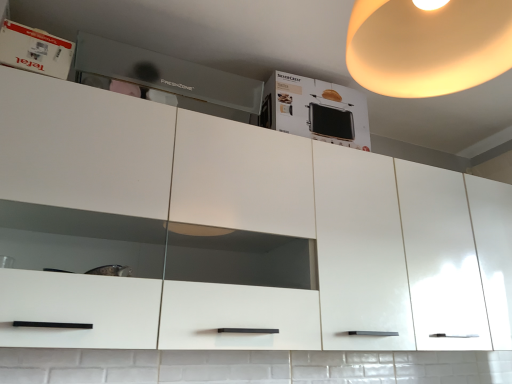
What do you see at coordinates (167, 73) in the screenshot? I see `matte gray drawer at upper center` at bounding box center [167, 73].

What are the coordinates of `matte gray drawer at upper center` in the screenshot? It's located at (167, 73).

Locate an element on the screen. The width and height of the screenshot is (512, 384). warm matte lampshade at upper right is located at coordinates (428, 46).

This screenshot has height=384, width=512. What are the coordinates of `matte gray drawer at upper center` in the screenshot? It's located at (167, 73).

From the image's perspective, is matte gray drawer at upper center located above white cardboard box at upper center?

Yes, from the image's perspective, matte gray drawer at upper center is over white cardboard box at upper center.

Considering the sizes of objects matte gray drawer at upper center and white cardboard box at upper center in the image provided, who is taller, matte gray drawer at upper center or white cardboard box at upper center?

With more height is white cardboard box at upper center.

Considering the relative sizes of matte gray drawer at upper center and white cardboard box at upper center in the image provided, is matte gray drawer at upper center bigger than white cardboard box at upper center?

Incorrect, matte gray drawer at upper center is not larger than white cardboard box at upper center.

Is there a large distance between matte gray drawer at upper center and white cardboard box at upper center?

Actually, matte gray drawer at upper center and white cardboard box at upper center are a little close together.

From a real-world perspective, which object stands above the other?

From a 3D spatial view, white cardboard box at upper center is above.

Measure the distance between white cardboard box at upper center and matte gray drawer at upper center.

A distance of 9.57 inches exists between white cardboard box at upper center and matte gray drawer at upper center.

Visually, is white cardboard box at upper center positioned to the left or to the right of matte gray drawer at upper center?

Based on their positions, white cardboard box at upper center is located to the right of matte gray drawer at upper center.

Consider the image. Considering the sizes of white cardboard box at upper center and matte gray drawer at upper center in the image, is white cardboard box at upper center taller or shorter than matte gray drawer at upper center?

In the image, white cardboard box at upper center appears to be taller than matte gray drawer at upper center.

Looking at their sizes, would you say warm matte lampshade at upper right is wider or thinner than matte gray drawer at upper center?

Considering their sizes, warm matte lampshade at upper right looks broader than matte gray drawer at upper center.

From the picture: Is warm matte lampshade at upper right looking in the opposite direction of matte gray drawer at upper center?

No, warm matte lampshade at upper right's orientation is not away from matte gray drawer at upper center.

Is warm matte lampshade at upper right outside of matte gray drawer at upper center?

Absolutely, warm matte lampshade at upper right is external to matte gray drawer at upper center.

Considering the positions of objects warm matte lampshade at upper right and matte gray drawer at upper center in the image provided, who is more to the right, warm matte lampshade at upper right or matte gray drawer at upper center?

Positioned to the right is warm matte lampshade at upper right.

Consider the image. From a real-world perspective, is white cardboard box at upper center located higher than white glossy box at upper left?

Yes, from a real-world perspective, white cardboard box at upper center is above white glossy box at upper left.

Looking at this image, can you tell me how much white cardboard box at upper center and white glossy box at upper left differ in facing direction?

They differ by 7.98e-05 degrees in their facing directions.

Is white cardboard box at upper center next to white glossy box at upper left and touching it?

They are not placed beside each other.

Image resolution: width=512 pixels, height=384 pixels. Find the location of `cabinetry below the white glossy box at upper left (from the image's perspective)`. cabinetry below the white glossy box at upper left (from the image's perspective) is located at coordinates (315, 110).

Are matte gray drawer at upper center and white glossy box at upper left far apart?

Actually, matte gray drawer at upper center and white glossy box at upper left are a little close together.

Considering the relative positions of matte gray drawer at upper center and white glossy box at upper left in the image provided, is matte gray drawer at upper center to the left of white glossy box at upper left from the viewer's perspective?

In fact, matte gray drawer at upper center is to the right of white glossy box at upper left.

How many degrees apart are the facing directions of matte gray drawer at upper center and white glossy box at upper left?

There is a 7.74e-05-degree angle between the facing directions of matte gray drawer at upper center and white glossy box at upper left.

Is matte gray drawer at upper center facing away from white glossy box at upper left?

That's not correct — matte gray drawer at upper center is not looking away from white glossy box at upper left.

From the image's perspective, is warm matte lampshade at upper right on white cardboard box at upper center?

Yes, from the image's perspective, warm matte lampshade at upper right is on top of white cardboard box at upper center.

Is warm matte lampshade at upper right inside or outside of white cardboard box at upper center?

The correct answer is: outside.

Based on the photo, from a real-world perspective, is warm matte lampshade at upper right positioned over white cardboard box at upper center based on gravity?

Yes, from a real-world perspective, warm matte lampshade at upper right is on top of white cardboard box at upper center.

Is warm matte lampshade at upper right aimed at white cardboard box at upper center?

No, warm matte lampshade at upper right is not turned towards white cardboard box at upper center.

Can you confirm if white glossy box at upper left is positioned to the right of matte gray drawer at upper center?

No, white glossy box at upper left is not to the right of matte gray drawer at upper center.

Is matte gray drawer at upper center surrounded by white glossy box at upper left?

No, matte gray drawer at upper center is located outside of white glossy box at upper left.

From a real-world perspective, is white glossy box at upper left positioned above or below matte gray drawer at upper center?

Clearly, from a real-world perspective, white glossy box at upper left is below matte gray drawer at upper center.

Locate an element on the screen. The height and width of the screenshot is (384, 512). cabinetry above the matte gray drawer at upper center (from a real-world perspective) is located at coordinates (315, 110).

The height and width of the screenshot is (384, 512). I want to click on cabinetry below the matte gray drawer at upper center (from the image's perspective), so click(x=315, y=110).

From the picture: Based on their spatial positions, is white glossy box at upper left or warm matte lampshade at upper right closer to matte gray drawer at upper center?

Among the two, white glossy box at upper left is located nearer to matte gray drawer at upper center.

Estimate the real-world distances between objects in this image. Which object is closer to white glossy box at upper left, white cardboard box at upper center or matte gray drawer at upper center?

matte gray drawer at upper center is closer to white glossy box at upper left.

Estimate the real-world distances between objects in this image. Which object is further from white glossy box at upper left, matte gray drawer at upper center or warm matte lampshade at upper right?

The object further to white glossy box at upper left is warm matte lampshade at upper right.

Estimate the real-world distances between objects in this image. Which object is closer to white cardboard box at upper center, warm matte lampshade at upper right or matte gray drawer at upper center?

matte gray drawer at upper center is closer to white cardboard box at upper center.

Looking at the image, which one is located further to white cardboard box at upper center, white glossy box at upper left or warm matte lampshade at upper right?

white glossy box at upper left.

Looking at the image, which one is located further to warm matte lampshade at upper right, white glossy box at upper left or white cardboard box at upper center?

Based on the image, white glossy box at upper left appears to be further to warm matte lampshade at upper right.

Estimate the real-world distances between objects in this image. Which object is further from warm matte lampshade at upper right, white cardboard box at upper center or white glossy box at upper left?

white glossy box at upper left.

Based on their spatial positions, is white glossy box at upper left or matte gray drawer at upper center closer to warm matte lampshade at upper right?

Among the two, matte gray drawer at upper center is located nearer to warm matte lampshade at upper right.

Find the location of a particular element. This screenshot has height=384, width=512. home appliance situated between white glossy box at upper left and white cardboard box at upper center from left to right is located at coordinates (167, 73).

This screenshot has width=512, height=384. Identify the location of cabinetry located between white glossy box at upper left and warm matte lampshade at upper right in the left-right direction. (315, 110).

You are a GUI agent. You are given a task and a screenshot of the screen. Output one action in this format:
    pyautogui.click(x=<x>, y=<y>)
    Task: Click on the cabinetry between matte gray drawer at upper center and warm matte lampshade at upper right
    
    Given the screenshot: What is the action you would take?
    pyautogui.click(x=315, y=110)

What are the coordinates of `home appliance between white glossy box at upper left and warm matte lampshade at upper right in the horizontal direction` in the screenshot? It's located at (167, 73).